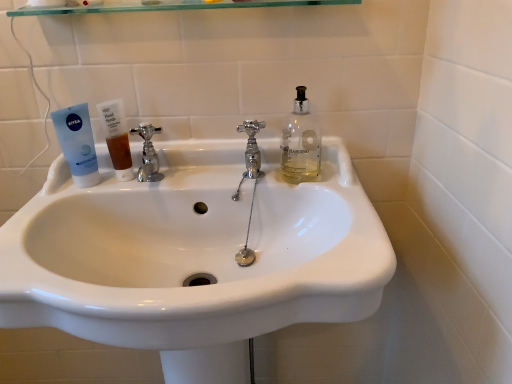
Question: From the image's perspective, is white glossy sink at center above or below chrome metallic faucet at center left, placed as the second tap when sorted from right to left?

Choices:
 (A) above
 (B) below

Answer: (B)

Question: Considering the relative positions of white glossy sink at center and chrome metallic faucet at center left, the first tap positioned from the left, in the image provided, is white glossy sink at center to the left or to the right of chrome metallic faucet at center left, the first tap positioned from the left,?

Choices:
 (A) left
 (B) right

Answer: (B)

Question: Which object is the farthest from the chrome metallic faucet at center left, the first tap positioned from the left?

Choices:
 (A) white glossy sink at center
 (B) blue matte tube at left
 (C) transparent glass shelf at upper center
 (D) translucent amber liquid at sink left
 (E) chrome/metallic faucet at center, the first tap in the right-to-left sequence

Answer: (C)

Question: Estimate the real-world distances between objects in this image. Which object is farther from the transparent glass shelf at upper center?

Choices:
 (A) chrome/metallic faucet at center, the first tap in the right-to-left sequence
 (B) translucent amber liquid at sink left
 (C) blue matte tube at left
 (D) chrome metallic faucet at center left, the first tap positioned from the left
 (E) white glossy sink at center

Answer: (E)